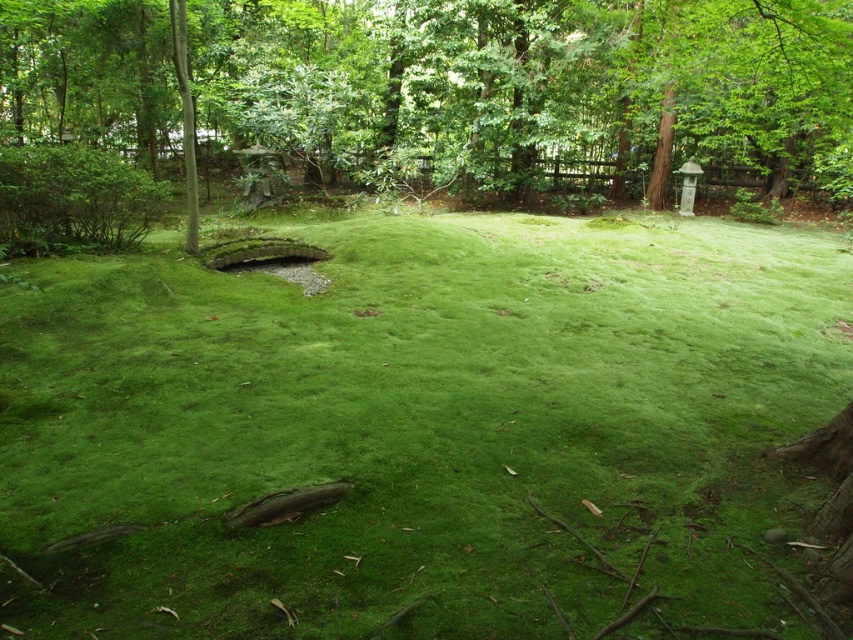
You are a gardener who needs to water the green leafy tree at center from the green mossy ground at center. You have a hose that can reach up to 25 feet. Will you be able to water the tree without moving the hose nozzle?

The distance between the green mossy ground at center and the green leafy tree at center is 28.18 feet, which is beyond the 25 feet reach of the hose. Therefore, you will need to move the hose nozzle closer to reach the tree.

You are standing in the garden and want to take a photo of both the point at coordinates point (335, 566) and point (792, 92). Which point should you focus on first to ensure both are in focus?

You should focus on point (335, 566) first because it is closer to the camera than point (792, 92), ensuring both will be in focus when using depth of field.